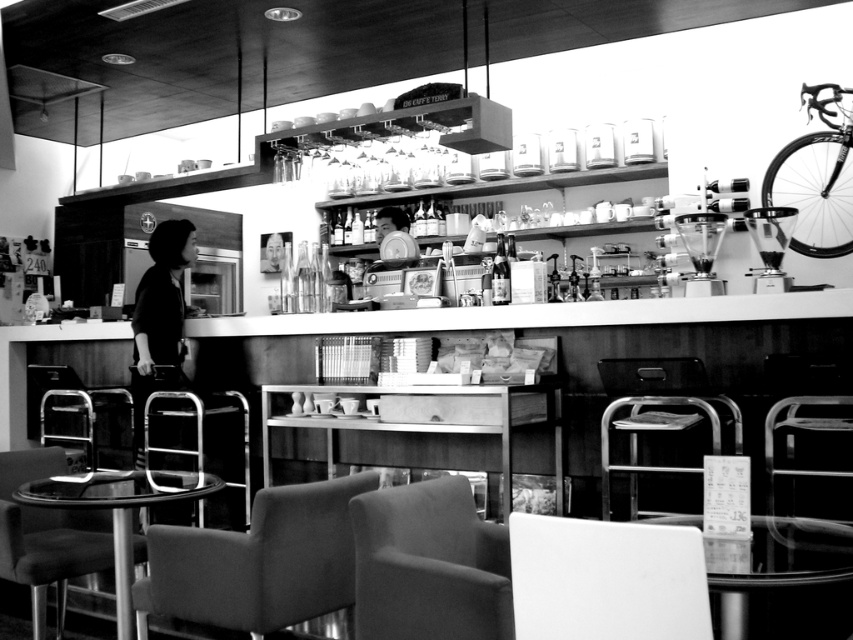
Question: Which of the following is the closest to the observer?

Choices:
 (A) glassy clear table at lower left
 (B) shiny metallic bicycle at upper right
 (C) dark fabric jacket at left

Answer: (A)

Question: Which point is farther to the camera?

Choices:
 (A) glassy clear table at lower left
 (B) smooth black shirt at center
 (C) suede-like fabric chair at lower center
 (D) white matte chair at lower center

Answer: (B)

Question: In this image, where is white matte chair at lower center located relative to shiny metallic bicycle at upper right?

Choices:
 (A) below
 (B) above

Answer: (A)

Question: Among these objects, which one is nearest to the camera?

Choices:
 (A) shiny metallic bicycle at upper right
 (B) metallic silver bar stool at lower center
 (C) smooth black shirt at center

Answer: (B)

Question: Does suede-like fabric chair at lower center appear under soft fabric chair at center?

Choices:
 (A) no
 (B) yes

Answer: (B)

Question: Is white matte chair at lower center closer to camera compared to glassy clear table at lower left?

Choices:
 (A) yes
 (B) no

Answer: (A)